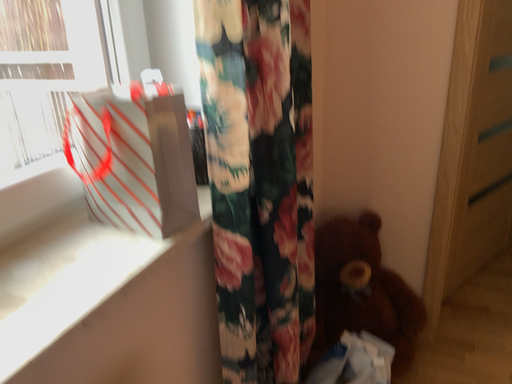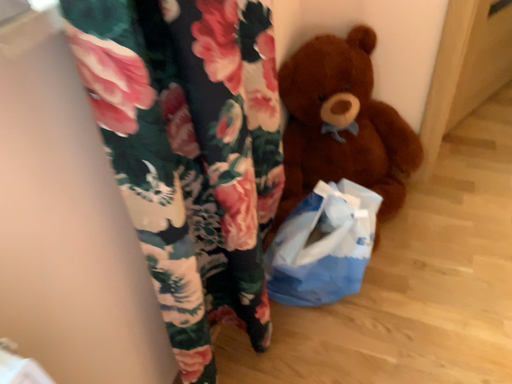
Question: Which way did the camera rotate in the video?

Choices:
 (A) rotated upward
 (B) rotated downward

Answer: (B)